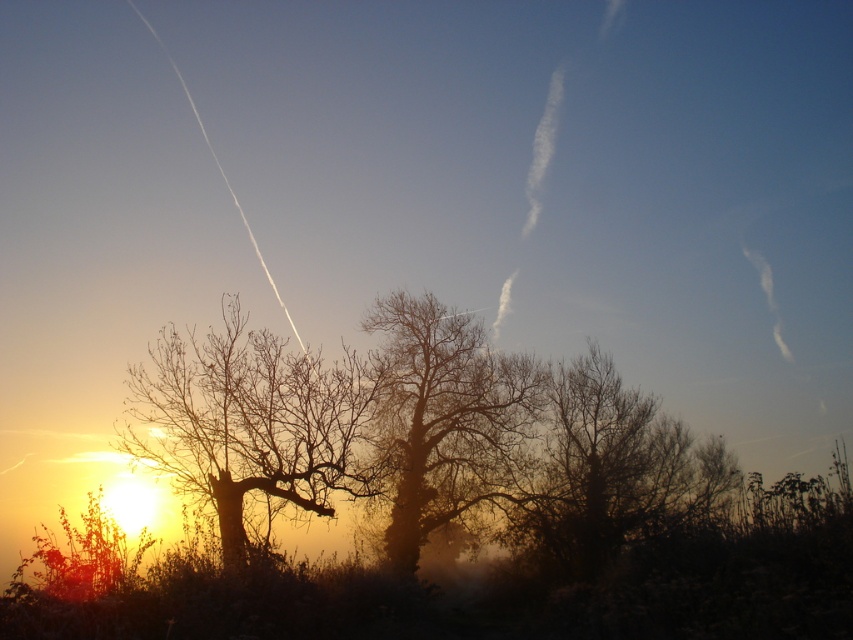
Is silhouette bare tree at left to the left of brown textured tree at center from the viewer's perspective?

Indeed, silhouette bare tree at left is positioned on the left side of brown textured tree at center.

Is silhouette bare tree at left taller than brown textured tree at center?

In fact, silhouette bare tree at left may be shorter than brown textured tree at center.

Is point (202, 404) closer to viewer compared to point (735, 490)?

Yes, it is in front of point (735, 490).

At what (x,y) coordinates should I click in order to perform the action: click on silhouette bare tree at left. Please return your answer as a coordinate pair (x, y). Looking at the image, I should click on (252, 424).

Who is more distant from viewer, [183,449] or [421,381]?

The point [421,381] is more distant.

Who is higher up, silhouette bare tree at left or bare wood tree at center?

silhouette bare tree at left is higher up.

Find the location of a particular element. silhouette bare tree at left is located at coordinates (252, 424).

You are a GUI agent. You are given a task and a screenshot of the screen. Output one action in this format:
    pyautogui.click(x=<x>, y=<y>)
    Task: Click on the silhouette bare tree at left
    This screenshot has width=853, height=640.
    Given the screenshot: What is the action you would take?
    pyautogui.click(x=252, y=424)

Can you confirm if bare wood tree at center is shorter than brown textured tree at center?

Yes.

Is point (494, 364) farther from viewer compared to point (573, 442)?

Yes, it is behind point (573, 442).

You are a GUI agent. You are given a task and a screenshot of the screen. Output one action in this format:
    pyautogui.click(x=<x>, y=<y>)
    Task: Click on the bare wood tree at center
    Image resolution: width=853 pixels, height=640 pixels.
    Given the screenshot: What is the action you would take?
    pyautogui.click(x=445, y=417)